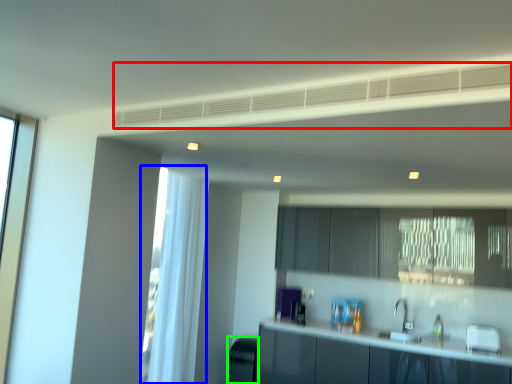
Question: Considering the real-world distances, which object is closest to exhaust hood (highlighted by a red box)? curtain (highlighted by a blue box) or appliance (highlighted by a green box).

Choices:
 (A) curtain
 (B) appliance

Answer: (A)